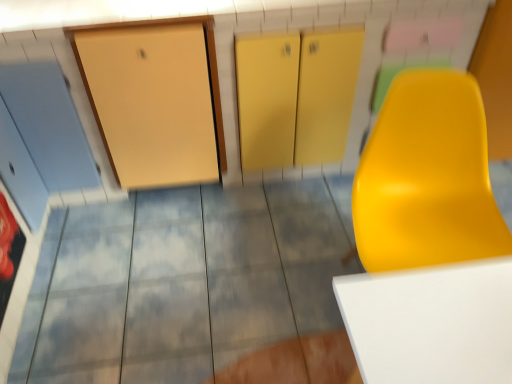
Describe the element at coordinates (193, 288) in the screenshot. I see `matte yellow tile at center` at that location.

Find the location of a particular element. matte yellow tile at center is located at coordinates (193, 288).

What do you see at coordinates (429, 241) in the screenshot? The width and height of the screenshot is (512, 384). I see `matte yellow chair at right` at bounding box center [429, 241].

This screenshot has width=512, height=384. I want to click on matte yellow chair at right, so click(429, 241).

The image size is (512, 384). Identify the location of matte yellow tile at center. (193, 288).

Can you confirm if matte yellow chair at right is positioned to the right of matte yellow tile at center?

Yes, matte yellow chair at right is to the right of matte yellow tile at center.

Is matte yellow chair at right positioned in front of matte yellow tile at center?

Yes, it is.

Which point is more forward, (471, 255) or (165, 377)?

Point (471, 255)

From the image's perspective, is matte yellow chair at right above or below matte yellow tile at center?

matte yellow chair at right is situated higher than matte yellow tile at center in the image.

From a real-world perspective, is matte yellow chair at right above or below matte yellow tile at center?

Clearly, from a real-world perspective, matte yellow chair at right is above matte yellow tile at center.

Is matte yellow chair at right wider or thinner than matte yellow tile at center?

Clearly, matte yellow chair at right has less width compared to matte yellow tile at center.

Is matte yellow chair at right taller or shorter than matte yellow tile at center?

In the image, matte yellow chair at right appears to be taller than matte yellow tile at center.

Who is smaller, matte yellow chair at right or matte yellow tile at center?

With smaller size is matte yellow chair at right.

From the picture: Is matte yellow tile at center surrounded by matte yellow chair at right?

Definitely not — matte yellow tile at center is not inside matte yellow chair at right.

Is matte yellow chair at right in contact with matte yellow tile at center?

There is a gap between matte yellow chair at right and matte yellow tile at center.

Is matte yellow chair at right turned away from matte yellow tile at center?

No, matte yellow chair at right is not facing away from matte yellow tile at center.

Image resolution: width=512 pixels, height=384 pixels. There is a matte yellow tile at center. In order to click on furniture above it (from a real-world perspective) in this screenshot , I will do `click(429, 241)`.

Considering the positions of objects matte yellow tile at center and matte yellow chair at right in the image provided, who is more to the right, matte yellow tile at center or matte yellow chair at right?

matte yellow chair at right.

Relative to matte yellow chair at right, is matte yellow tile at center in front or behind?

matte yellow tile at center is behind matte yellow chair at right.

Which is behind, point (254, 376) or point (440, 206)?

The point (254, 376) is behind.

From the image's perspective, would you say matte yellow tile at center is shown under matte yellow chair at right?

Indeed, from the image's perspective, matte yellow tile at center is shown beneath matte yellow chair at right.

From a real-world perspective, who is located lower, matte yellow tile at center or matte yellow chair at right?

matte yellow tile at center, from a real-world perspective.

Is matte yellow tile at center thinner than matte yellow chair at right?

No.

Considering the relative sizes of matte yellow tile at center and matte yellow chair at right in the image provided, is matte yellow tile at center shorter than matte yellow chair at right?

Indeed, matte yellow tile at center has a lesser height compared to matte yellow chair at right.

Considering the sizes of objects matte yellow tile at center and matte yellow chair at right in the image provided, who is bigger, matte yellow tile at center or matte yellow chair at right?

matte yellow tile at center is bigger.

Is matte yellow tile at center inside or outside of matte yellow chair at right?

matte yellow tile at center cannot be found inside matte yellow chair at right.

Is the surface of matte yellow tile at center in direct contact with matte yellow chair at right?

matte yellow tile at center and matte yellow chair at right are clearly separated.

Is matte yellow tile at center facing towards matte yellow chair at right?

No, matte yellow tile at center is not turned towards matte yellow chair at right.

Identify the location of tile on the left of matte yellow chair at right. (193, 288).

This screenshot has width=512, height=384. In order to click on furniture that is above the matte yellow tile at center (from the image's perspective) in this screenshot , I will do `click(429, 241)`.

You are a GUI agent. You are given a task and a screenshot of the screen. Output one action in this format:
    pyautogui.click(x=<x>, y=<y>)
    Task: Click on the tile behind the matte yellow chair at right
    The height and width of the screenshot is (384, 512).
    Given the screenshot: What is the action you would take?
    pyautogui.click(x=193, y=288)